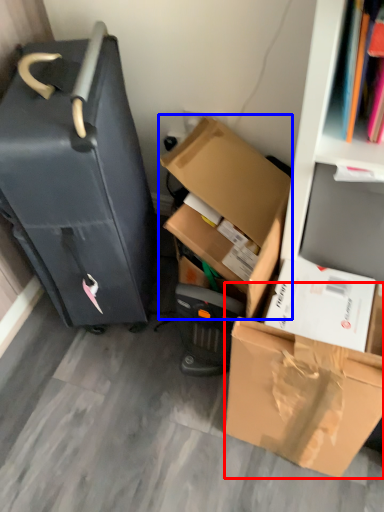
Question: Which object appears farthest to the camera in this image, box (highlighted by a red box) or box (highlighted by a blue box)?

Choices:
 (A) box
 (B) box

Answer: (B)